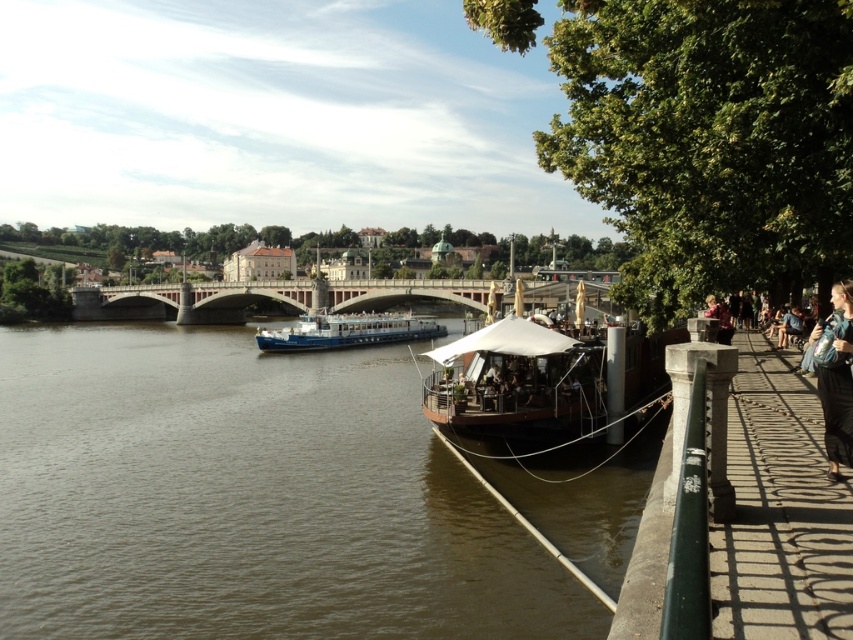
Is white canvas boat at center above blue denim jacket at lower right?

Actually, white canvas boat at center is below blue denim jacket at lower right.

Between point (541, 352) and point (840, 310), which one is positioned behind?

The point (541, 352) is more distant.

You are a GUI agent. You are given a task and a screenshot of the screen. Output one action in this format:
    pyautogui.click(x=<x>, y=<y>)
    Task: Click on the white canvas boat at center
    This screenshot has height=640, width=853.
    Given the screenshot: What is the action you would take?
    pyautogui.click(x=521, y=385)

This screenshot has height=640, width=853. Identify the location of white canvas boat at center. (521, 385).

Does point (206, 438) come behind point (556, 404)?

That is True.

Locate an element on the screen. brown water at center is located at coordinates (248, 499).

Where is `brown water at center`? The width and height of the screenshot is (853, 640). brown water at center is located at coordinates (248, 499).

Is concrete bridge at center above blue denim jacket at lower right?

Indeed, concrete bridge at center is positioned over blue denim jacket at lower right.

Can you confirm if concrete bridge at center is thinner than blue denim jacket at lower right?

No.

The width and height of the screenshot is (853, 640). I want to click on concrete bridge at center, so click(x=267, y=298).

This screenshot has height=640, width=853. What are the coordinates of `concrete bridge at center` in the screenshot? It's located at (267, 298).